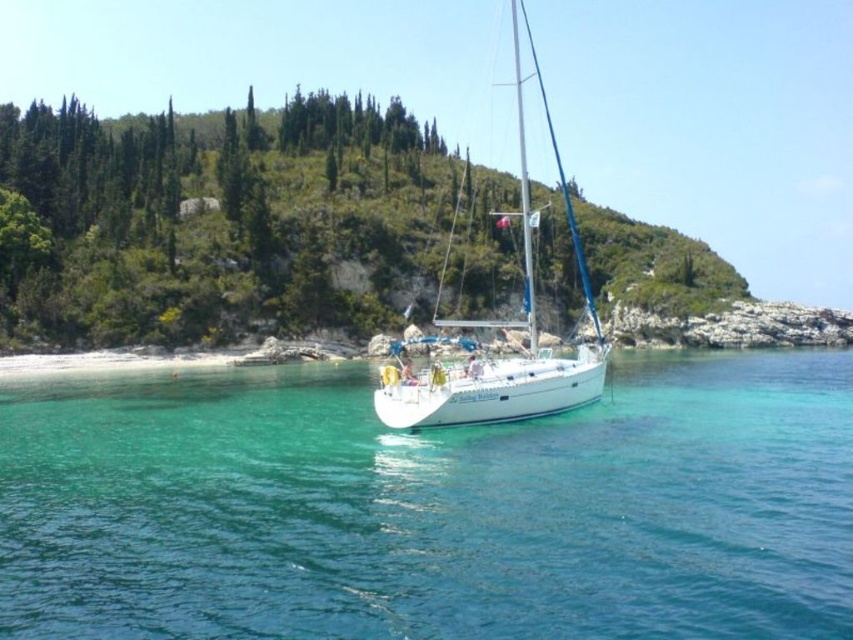
Does point (635, 563) lie behind point (521, 17)?

No, (635, 563) is in front of (521, 17).

Does clear blue water at center have a greater height compared to white glossy sailboat at center?

No.

Locate an element on the screen. This screenshot has width=853, height=640. clear blue water at center is located at coordinates pyautogui.click(x=430, y=508).